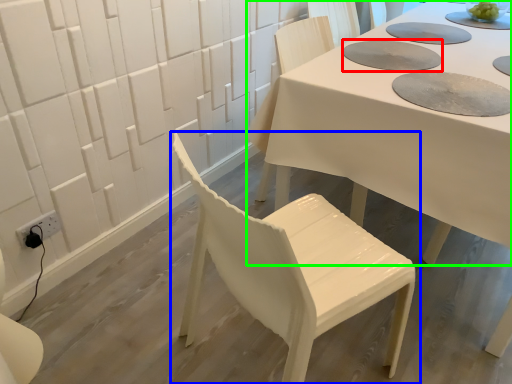
Question: Based on their relative distances, which object is farther from paper plate (highlighted by a red box)? Choose from chair (highlighted by a blue box) and table (highlighted by a green box).

Choices:
 (A) chair
 (B) table

Answer: (A)